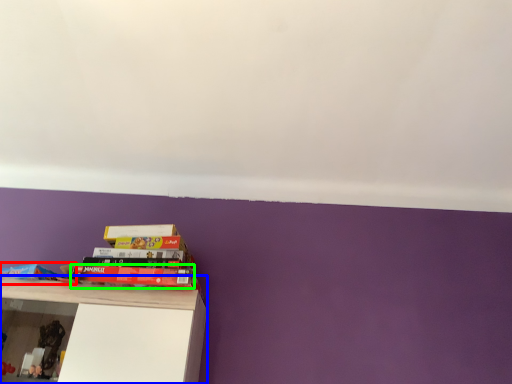
Question: Estimate the real-world distances between objects in this image. Which object is closer to book (highlighted by a red box), shelf (highlighted by a blue box) or book (highlighted by a green box)?

Choices:
 (A) shelf
 (B) book

Answer: (B)